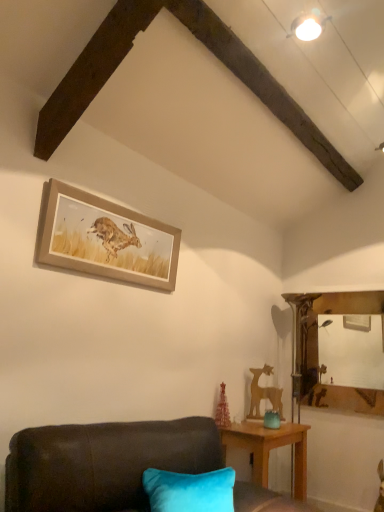
Where is `vacant region above wooden framed print of hare at upper center (from a real-world perspective)`? The height and width of the screenshot is (512, 384). vacant region above wooden framed print of hare at upper center (from a real-world perspective) is located at coordinates (119, 206).